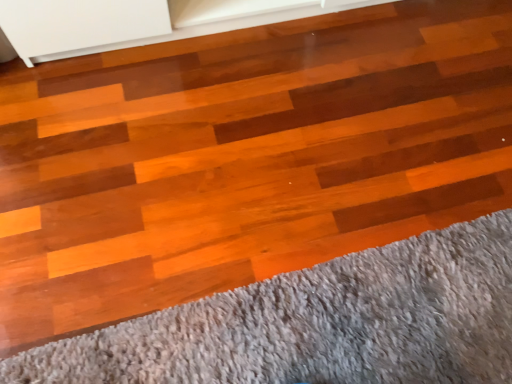
This screenshot has height=384, width=512. Find the location of `unoccupied space behind gray shaggy rug at lower right`. unoccupied space behind gray shaggy rug at lower right is located at coordinates (307, 127).